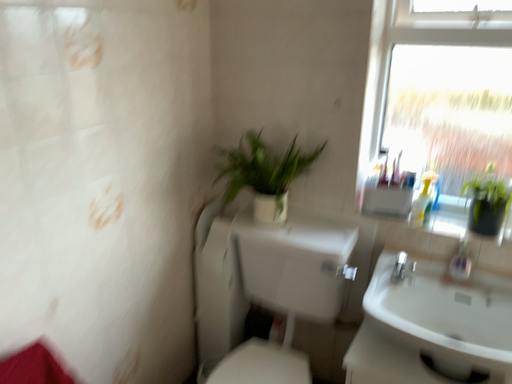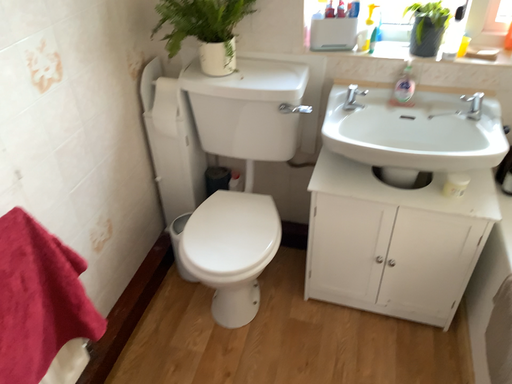
Question: Which way did the camera rotate in the video?

Choices:
 (A) rotated left
 (B) rotated right

Answer: (B)